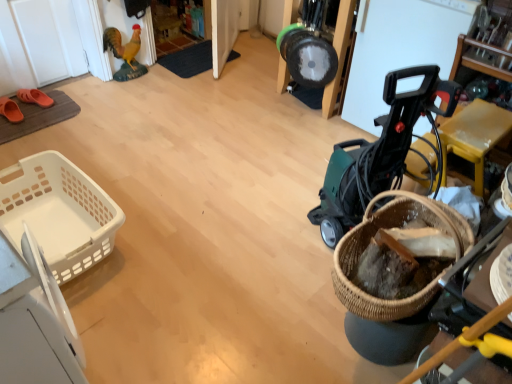
Locate an element on the screen. blank area beneath white plastic basket at left, which appears as the 2th basket when viewed from the front (from a real-world perspective) is located at coordinates (60, 223).